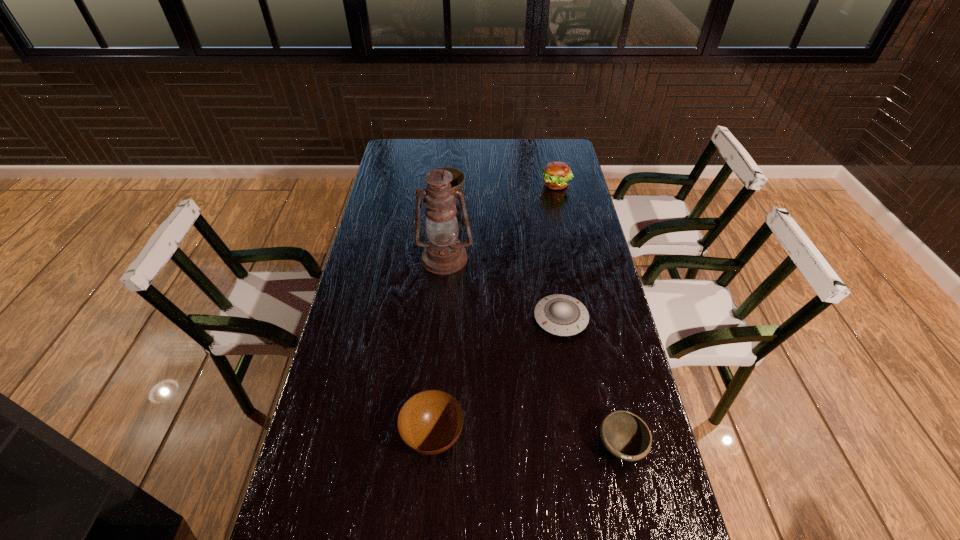
The width and height of the screenshot is (960, 540). What are the coordinates of `the tallest object` in the screenshot? It's located at (443, 254).

Identify the location of the third farthest object. Image resolution: width=960 pixels, height=540 pixels. (443, 254).

Where is `the farthest bowl`? The image size is (960, 540). the farthest bowl is located at coordinates (457, 182).

Where is `hamburger`? The width and height of the screenshot is (960, 540). hamburger is located at coordinates (556, 174).

Find the location of a particular element. the second tallest bowl is located at coordinates (430, 422).

You are a GUI agent. You are given a task and a screenshot of the screen. Output one action in this format:
    pyautogui.click(x=<x>, y=<y>)
    Task: Click on the rightmost bowl
    This screenshot has height=540, width=960.
    Given the screenshot: What is the action you would take?
    pyautogui.click(x=626, y=436)

Find the location of a particular element. the second shortest object is located at coordinates (626, 436).

Find the location of a particular element. This screenshot has width=960, height=540. the fourth farthest object is located at coordinates (562, 315).

Where is `saucer`? The height and width of the screenshot is (540, 960). saucer is located at coordinates (562, 315).

Locate an element on the screen. The width and height of the screenshot is (960, 540). free spot located 0.390m on the front of the tallest object is located at coordinates (435, 375).